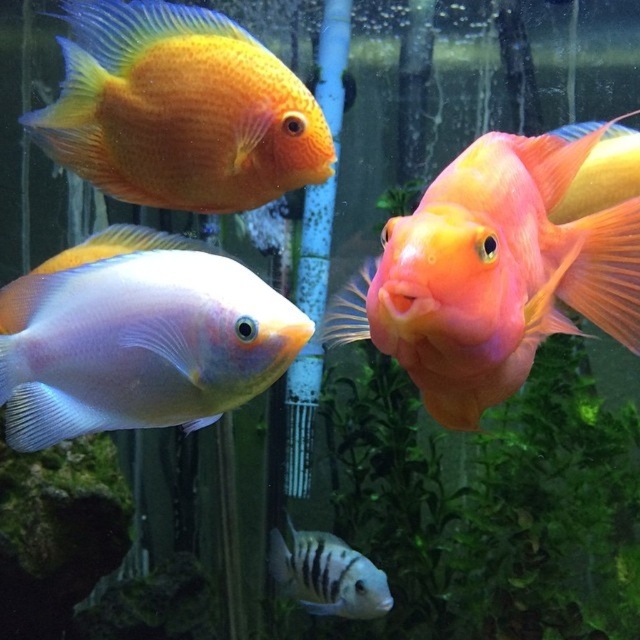
You are an underwater photographer aiming to capture the shiny orange fish at center and the black striped fish at lower center in a single shot. Given that your camera can only focus on one fish at a time, which fish should you focus on to ensure the other remains in the background?

You should focus on the shiny orange fish at center because it is taller than the black striped fish at lower center, so keeping it in focus will naturally place the smaller black striped fish at lower center in the background.

You are an aquarium visitor standing in front of the aquarium. You notice a point marked at coordinates (x=179, y=109). What is the fish located at that point?

The point at coordinates (x=179, y=109) indicates the shiny orange fish at upper center.